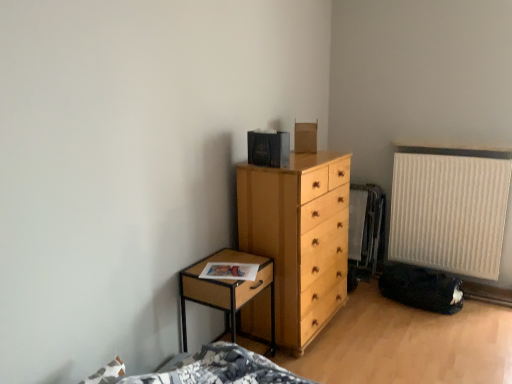
You are a GUI agent. You are given a task and a screenshot of the screen. Output one action in this format:
    pyautogui.click(x=<x>, y=<y>)
    Task: Click on the light wood chest of drawers at center
    
    Given the screenshot: What is the action you would take?
    pyautogui.click(x=298, y=238)

Describe the element at coordinates (227, 293) in the screenshot. The image size is (512, 384). I see `woodennightstand at left` at that location.

I want to click on beige ribbed radiator at right, so click(x=449, y=212).

The width and height of the screenshot is (512, 384). Identify the location of light wood chest of drawers at center. (298, 238).

Looking at this image, from a real-world perspective, is light wood chest of drawers at center positioned over woodennightstand at left based on gravity?

Correct, in the physical world, light wood chest of drawers at center is higher than woodennightstand at left.

Does light wood chest of drawers at center turn towards woodennightstand at left?

No, light wood chest of drawers at center does not turn towards woodennightstand at left.

Is beige ribbed radiator at right positioned before woodennightstand at left?

No, it is not.

Does beige ribbed radiator at right turn towards woodennightstand at left?

Yes, beige ribbed radiator at right is turned towards woodennightstand at left.

From a real-world perspective, is beige ribbed radiator at right under woodennightstand at left?

Incorrect, from a real-world perspective, beige ribbed radiator at right is higher than woodennightstand at left.

Choose the correct answer: Is woodennightstand at left inside beige ribbed radiator at right or outside it?

woodennightstand at left is located beyond the bounds of beige ribbed radiator at right.

How different are the orientations of woodennightstand at left and beige ribbed radiator at right in degrees?

The angular difference between woodennightstand at left and beige ribbed radiator at right is 90 degrees.

In the scene shown: Considering the sizes of objects woodennightstand at left and beige ribbed radiator at right in the image provided, who is smaller, woodennightstand at left or beige ribbed radiator at right?

With smaller size is woodennightstand at left.

Who is shorter, woodennightstand at left or beige ribbed radiator at right?

Standing shorter between the two is woodennightstand at left.

From the image's perspective, which is below, light wood chest of drawers at center or beige ribbed radiator at right?

From the image's view, light wood chest of drawers at center is below.

Considering the relative sizes of light wood chest of drawers at center and beige ribbed radiator at right in the image provided, is light wood chest of drawers at center smaller than beige ribbed radiator at right?

No, light wood chest of drawers at center is not smaller than beige ribbed radiator at right.

Is light wood chest of drawers at center positioned in front of beige ribbed radiator at right?

Yes, light wood chest of drawers at center is in front of beige ribbed radiator at right.

Is beige ribbed radiator at right completely or partially inside light wood chest of drawers at center?

No, beige ribbed radiator at right is located outside of light wood chest of drawers at center.

In the image, is beige ribbed radiator at right positioned in front of or behind light wood chest of drawers at center?

Clearly, beige ribbed radiator at right is behind light wood chest of drawers at center.

Considering the sizes of objects beige ribbed radiator at right and light wood chest of drawers at center in the image provided, who is bigger, beige ribbed radiator at right or light wood chest of drawers at center?

Bigger between the two is light wood chest of drawers at center.

Could light wood chest of drawers at center be considered to be inside beige ribbed radiator at right?

No, light wood chest of drawers at center is located outside of beige ribbed radiator at right.

You are a GUI agent. You are given a task and a screenshot of the screen. Output one action in this format:
    pyautogui.click(x=<x>, y=<y>)
    Task: Click on the chest of drawers that appears on the left of beige ribbed radiator at right
    
    Given the screenshot: What is the action you would take?
    pyautogui.click(x=298, y=238)

Between woodennightstand at left and light wood chest of drawers at center, which one has more height?

With more height is light wood chest of drawers at center.

Is woodennightstand at left in front of or behind light wood chest of drawers at center in the image?

woodennightstand at left is positioned closer to the viewer than light wood chest of drawers at center.

Which of these two, woodennightstand at left or light wood chest of drawers at center, is bigger?

light wood chest of drawers at center.

Image resolution: width=512 pixels, height=384 pixels. Find the location of `nightstand directly beneath the light wood chest of drawers at center (from a real-world perspective)`. nightstand directly beneath the light wood chest of drawers at center (from a real-world perspective) is located at coordinates (227, 293).

This screenshot has width=512, height=384. I want to click on nightstand on the left of beige ribbed radiator at right, so 227,293.

Looking at the image, which one is located closer to beige ribbed radiator at right, woodennightstand at left or light wood chest of drawers at center?

Based on the image, light wood chest of drawers at center appears to be nearer to beige ribbed radiator at right.

Considering their positions, is beige ribbed radiator at right positioned further to light wood chest of drawers at center than woodennightstand at left?

beige ribbed radiator at right lies further to light wood chest of drawers at center than the other object.

When comparing their distances from beige ribbed radiator at right, does light wood chest of drawers at center or woodennightstand at left seem closer?

Among the two, light wood chest of drawers at center is located nearer to beige ribbed radiator at right.

Estimate the real-world distances between objects in this image. Which object is further from woodennightstand at left, light wood chest of drawers at center or beige ribbed radiator at right?

The object further to woodennightstand at left is beige ribbed radiator at right.

Which object lies nearer to the anchor point light wood chest of drawers at center, woodennightstand at left or beige ribbed radiator at right?

woodennightstand at left is closer to light wood chest of drawers at center.

When comparing their distances from woodennightstand at left, does beige ribbed radiator at right or light wood chest of drawers at center seem further?

beige ribbed radiator at right lies further to woodennightstand at left than the other object.

This screenshot has width=512, height=384. I want to click on chest of drawers between woodennightstand at left and beige ribbed radiator at right from left to right, so click(x=298, y=238).